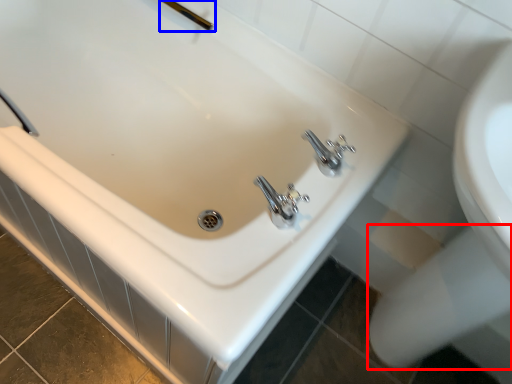
Question: Which of the following is the farthest to the observer, bidet (highlighted by a red box) or shower (highlighted by a blue box)?

Choices:
 (A) bidet
 (B) shower

Answer: (B)